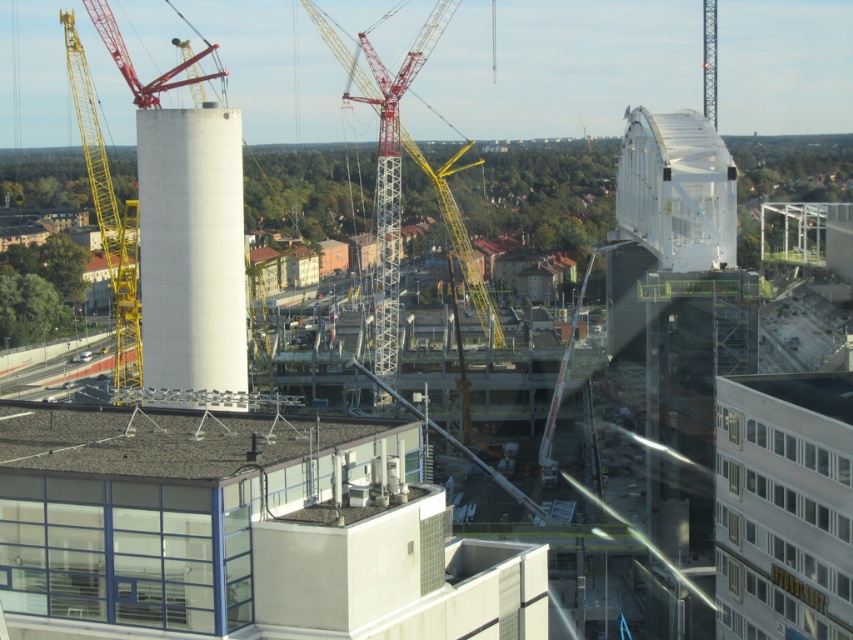
In the scene shown: You are a construction worker needing to move materials across the transparent glass bridge at upper right. The red metallic crane at upper left is currently operational. Considering their widths, which object is narrower and can allow easier passage of your equipment?

The transparent glass bridge at upper right is narrower than the red metallic crane at upper left, so it can allow easier passage of equipment.

You are a construction worker standing at the edge of the construction site. You need to determine which of the two points, point [711,221] or point [106,19], is closer to you. Which one should you choose?

Point [711,221] is closer to the viewer than point [106,19], so you should choose point [711,221].

You are a construction worker standing at the point marked as point (190, 248) in the urban construction site. Which object are you currently standing on?

The point (190, 248) is on white smooth cylinder at center, so you are standing on the white smooth cylinder at center.